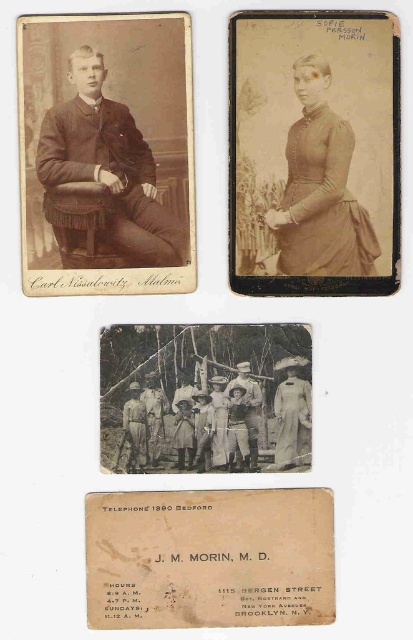
Based on the photo, you are an archivist arranging two vintage items in a display case. The items are the matte brown suit at center and the matte brown dress at center. The case has a divider that allows you to place each item on separate shelves. If you want to maintain the original distance between them as shown in the collage, how far apart should you place the two items in inches?

The matte brown suit at center and the matte brown dress at center should be placed 9.39 inches apart to maintain the original distance shown in the collage.

Looking at this image, you are a tailor working on a project and need to place both the matte brown dress at center and the khaki cotton uniform at center onto a display table. The table is only 10 inches wide. Can both items fit side by side on the table without overlapping?

The matte brown dress at center and the khaki cotton uniform at center are 11.12 inches apart from each other. Since the table is only 10 inches wide, they cannot fit side by side without overlapping.